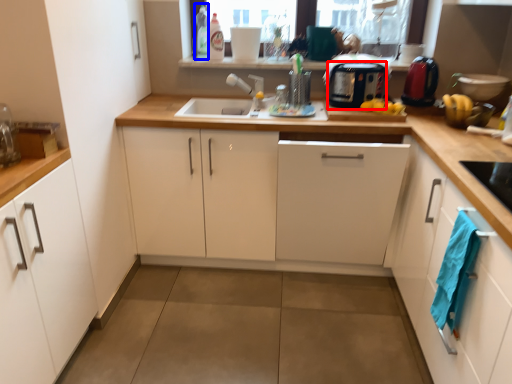
Question: Which object appears farthest to the camera in this image, appliance (highlighted by a red box) or bottle (highlighted by a blue box)?

Choices:
 (A) appliance
 (B) bottle

Answer: (B)